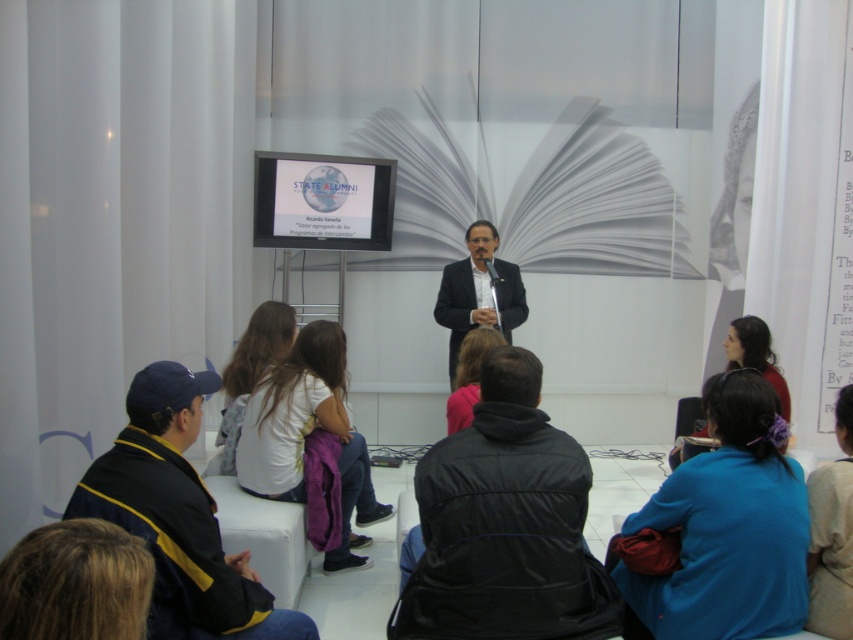
You are a photographer setting up for a presentation. You need to adjust the camera focus to capture both the blue fabric hair tie at lower right and the matte black jacket at lower right. Which object should you focus on first to ensure proper focus, considering their heights?

The blue fabric hair tie at lower right is taller than the matte black jacket at lower right, so you should focus on the blue fabric hair tie at lower right first to ensure proper focus.

You are organizing a small event and need to place a name tag on the light brown fabric jacket at lower right. According to the scene description, where should you position the name tag relative to the jacket?

The light brown fabric jacket at lower right is located at point (833, 532), so the name tag should be placed at that coordinate to ensure it is correctly positioned on the jacket.